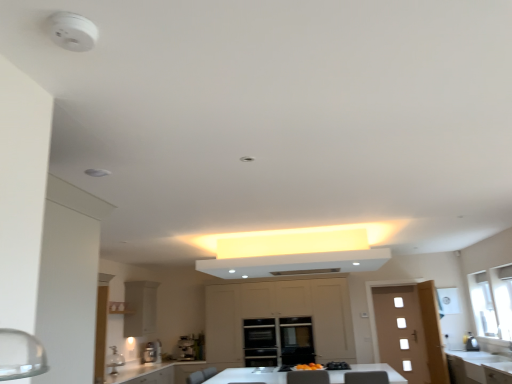
Question: Considering the relative positions of satin silver coffee machine at lower center, acting as the 1th coffee machine starting from the right, and satin silver coffee machine at center, acting as the 1th coffee machine starting from the left, in the image provided, is satin silver coffee machine at lower center, acting as the 1th coffee machine starting from the right, to the right of satin silver coffee machine at center, acting as the 1th coffee machine starting from the left, from the viewer's perspective?

Choices:
 (A) no
 (B) yes

Answer: (B)

Question: Can you confirm if satin silver coffee machine at lower center, acting as the 1th coffee machine starting from the right, is taller than satin silver coffee machine at center, placed as the second coffee machine when sorted from right to left?

Choices:
 (A) yes
 (B) no

Answer: (B)

Question: Is satin silver coffee machine at center, placed as the second coffee machine when sorted from right to left, surrounded by satin silver coffee machine at lower center, acting as the 1th coffee machine starting from the right?

Choices:
 (A) no
 (B) yes

Answer: (A)

Question: From the image's perspective, is satin silver coffee machine at lower center, acting as the 1th coffee machine starting from the right, on top of satin silver coffee machine at center, placed as the second coffee machine when sorted from right to left?

Choices:
 (A) no
 (B) yes

Answer: (A)

Question: Is the depth of satin silver coffee machine at lower center, acting as the second coffee machine starting from the left, greater than that of satin silver coffee machine at center, acting as the 1th coffee machine starting from the left?

Choices:
 (A) yes
 (B) no

Answer: (A)

Question: From the image's perspective, is wooden door at right positioned above or below satin silver kettle at right?

Choices:
 (A) above
 (B) below

Answer: (B)

Question: In the image, is wooden door at right positioned in front of or behind satin silver kettle at right?

Choices:
 (A) behind
 (B) front

Answer: (A)

Question: From a real-world perspective, is wooden door at right above or below satin silver kettle at right?

Choices:
 (A) below
 (B) above

Answer: (A)

Question: In terms of height, does wooden door at right look taller or shorter compared to satin silver kettle at right?

Choices:
 (A) short
 (B) tall

Answer: (B)

Question: Is matte beige cabinetry at center, which is the 1th cabinetry from right to left, taller or shorter than transparent glass window at right?

Choices:
 (A) tall
 (B) short

Answer: (A)

Question: Is matte beige cabinetry at center, which is the 1th cabinetry from right to left, bigger or smaller than transparent glass window at right?

Choices:
 (A) big
 (B) small

Answer: (A)

Question: Is matte beige cabinetry at center, the 2th cabinetry in the left-to-right sequence, wider or thinner than transparent glass window at right?

Choices:
 (A) wide
 (B) thin

Answer: (A)

Question: From the image's perspective, is matte beige cabinetry at center, the 2th cabinetry in the left-to-right sequence, positioned above or below transparent glass window at right?

Choices:
 (A) below
 (B) above

Answer: (A)

Question: In the image, is transparent glass window at right positioned in front of or behind matte beige cabinetry at center, which is the 1th cabinetry from right to left?

Choices:
 (A) behind
 (B) front

Answer: (B)

Question: Is transparent glass window at right situated inside matte beige cabinetry at center, the 2th cabinetry in the left-to-right sequence, or outside?

Choices:
 (A) inside
 (B) outside

Answer: (B)